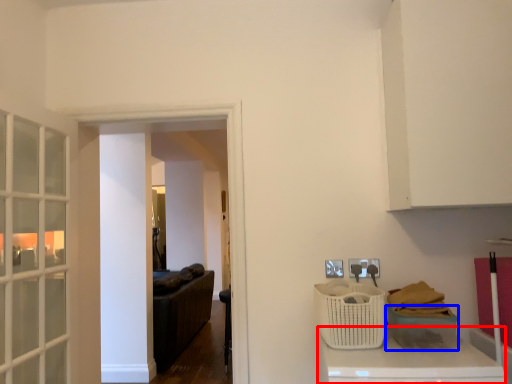
Question: Which of the following is the farthest to the observer, counter top (highlighted by a red box) or basket (highlighted by a blue box)?

Choices:
 (A) counter top
 (B) basket

Answer: (B)